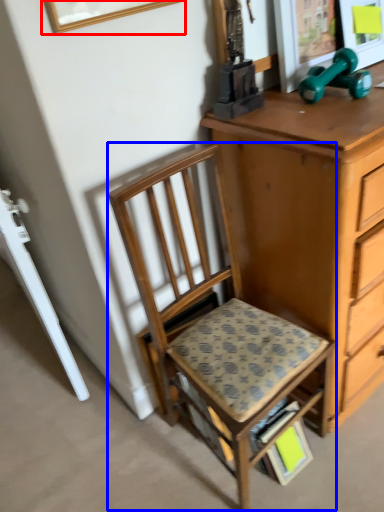
Question: Which object appears farthest to the camera in this image, picture frame (highlighted by a red box) or chair (highlighted by a blue box)?

Choices:
 (A) picture frame
 (B) chair

Answer: (B)